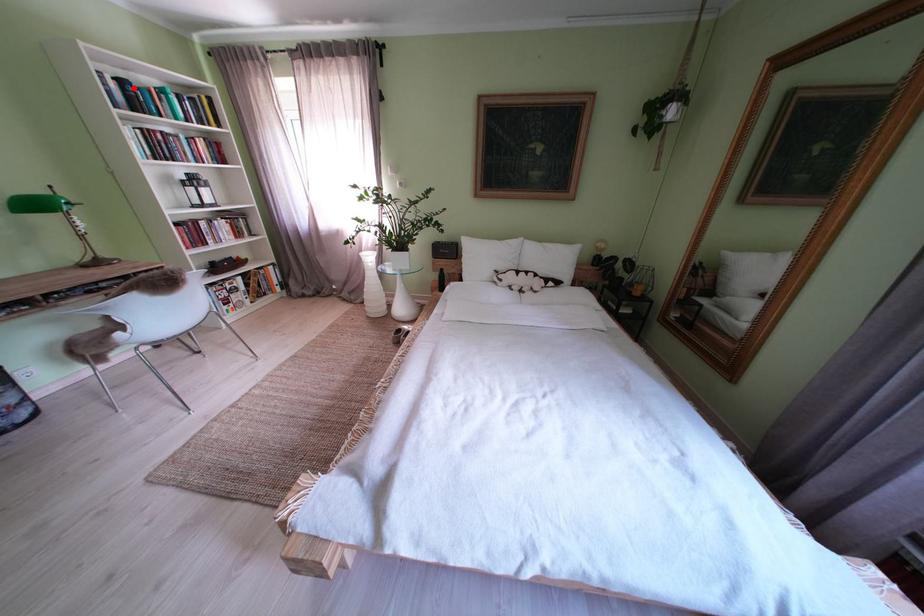
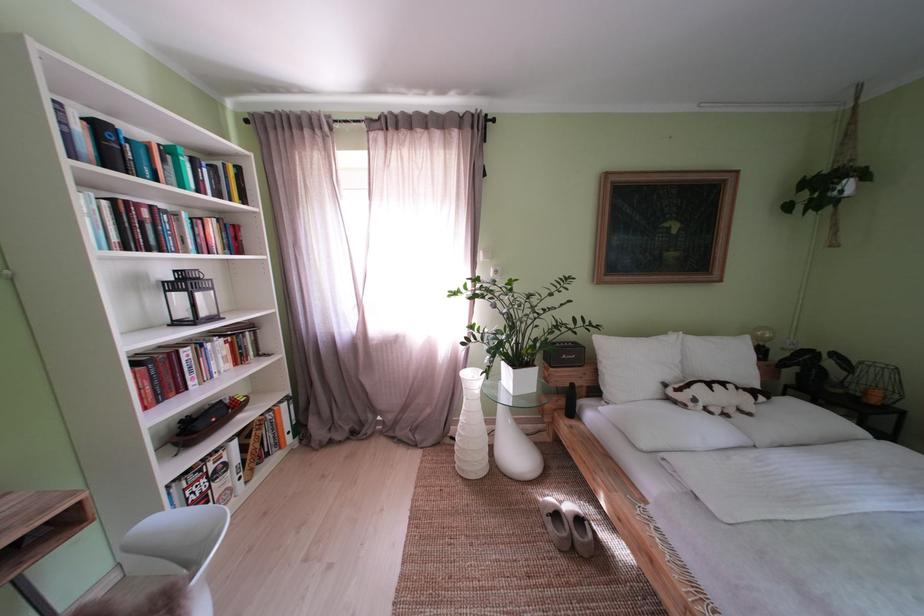
The point at the highlighted location is marked in the first image. Where is the corresponding point in the second image?

(111, 132)